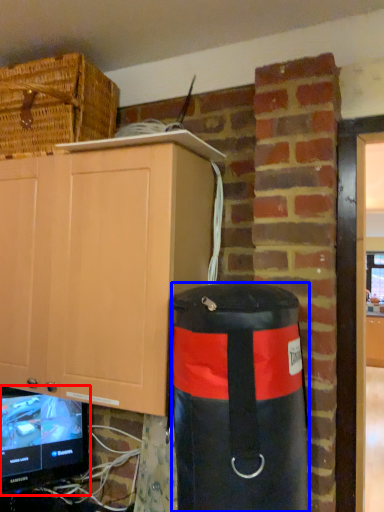
Question: Which of the following is the farthest to the observer, television (highlighted by a red box) or punching bag (highlighted by a blue box)?

Choices:
 (A) television
 (B) punching bag

Answer: (A)